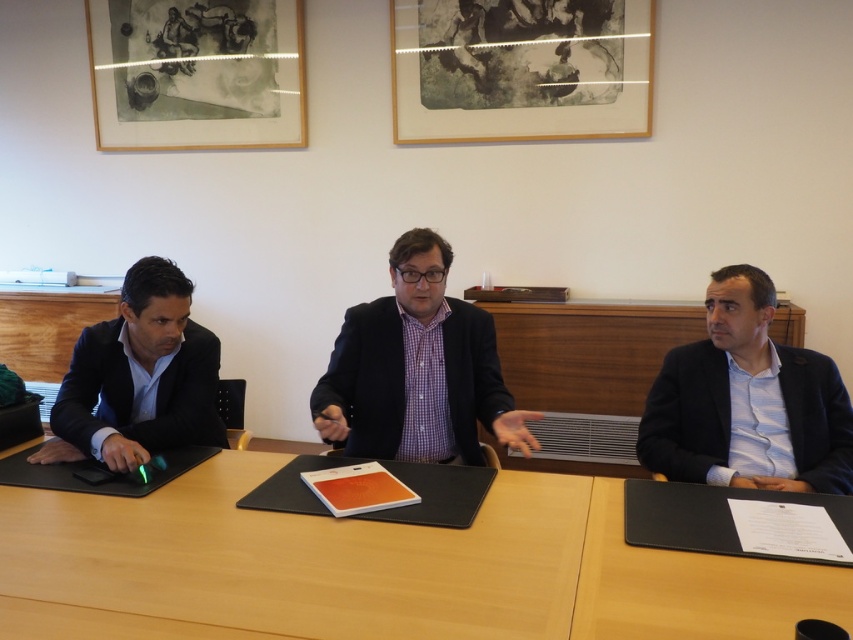
You are organizing a meeting in this office and need to place a large document on the wooden table at center. However, there is a matte wooden picture frame at upper left nearby. Which object has enough space to accommodate the document?

The matte wooden picture frame at upper left has enough space to accommodate the document because it is larger than the wooden table at center.

You are a photographer taking a picture of the meeting participants. You notice the matte wooden picture frame at upper left and the black matte suit at right. Which object is positioned higher in the image?

The matte wooden picture frame at upper left is positioned higher than the black matte suit at right in the image.